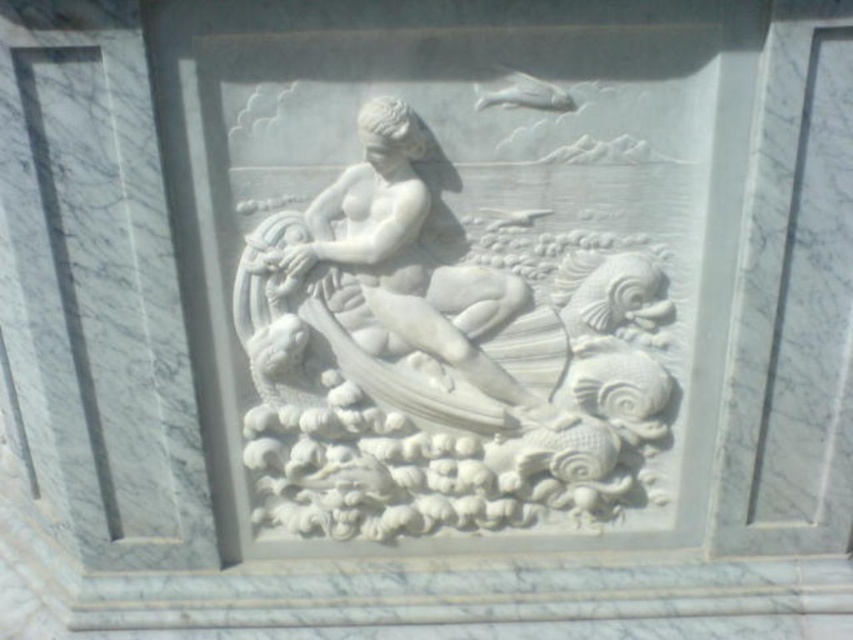
Find the location of `white marble mermaid at center`. white marble mermaid at center is located at coordinates pos(442,355).

Is white marble mermaid at center positioned before white marble statue at center?

No.

Find the location of a particular element. The image size is (853, 640). white marble mermaid at center is located at coordinates (442, 355).